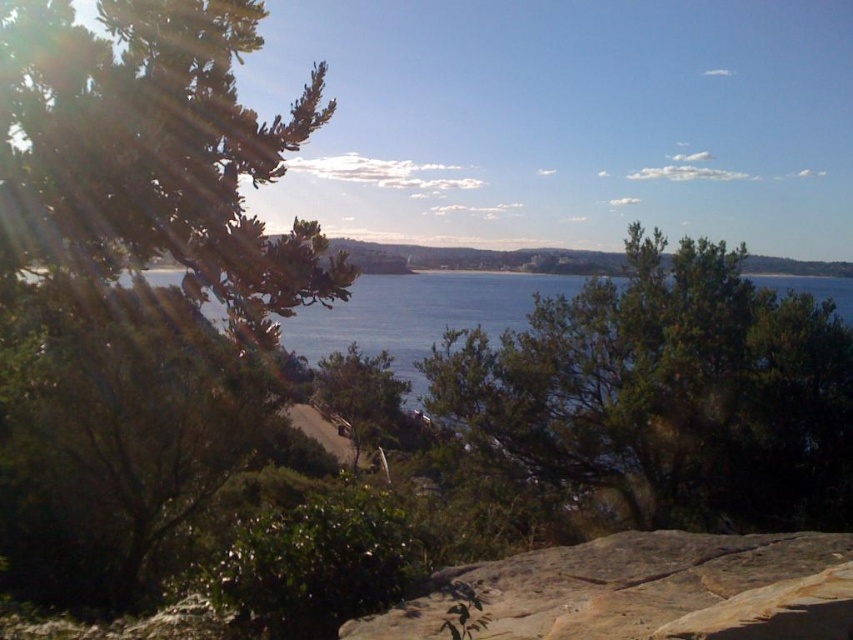
Question: Based on their relative distances, which object is nearer to the green leafy tree at center?

Choices:
 (A) green leafy tree at left
 (B) brown rough rock at lower center

Answer: (A)

Question: Can you confirm if green leafy tree at left is thinner than green leafy tree at center?

Choices:
 (A) no
 (B) yes

Answer: (B)

Question: Which point is farther from the camera taking this photo?

Choices:
 (A) (100, 16)
 (B) (660, 280)

Answer: (B)

Question: Is green leafy tree at left thinner than green leafy tree at center?

Choices:
 (A) no
 (B) yes

Answer: (B)

Question: Observing the image, what is the correct spatial positioning of green leafy tree at center in reference to brown rough rock at lower center?

Choices:
 (A) above
 (B) below

Answer: (A)

Question: Which point is farther from the camera taking this photo?

Choices:
 (A) (680, 595)
 (B) (166, 141)
 (C) (762, 298)

Answer: (C)